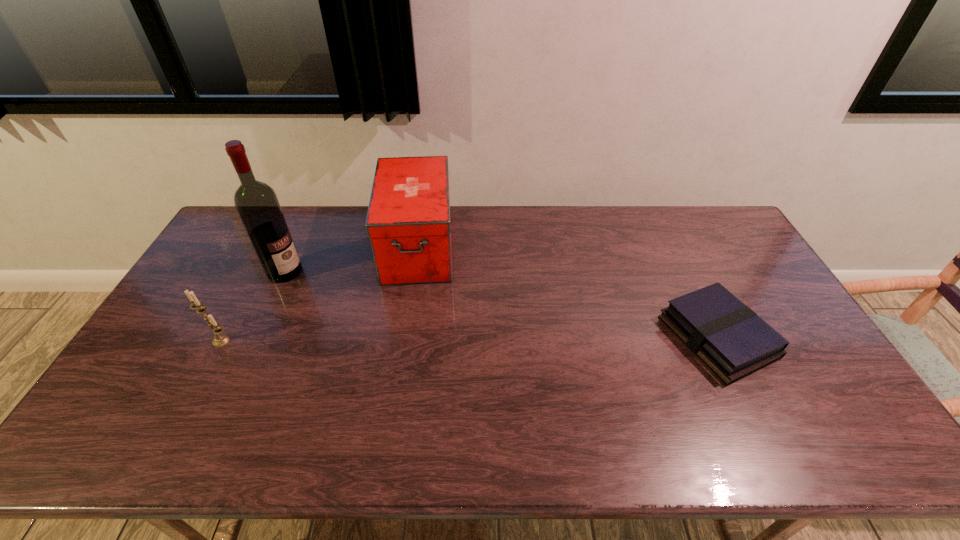
Find the location of a particular element. The image size is (960, 540). vacant space that is in between the candle and the rightmost object is located at coordinates (469, 339).

Image resolution: width=960 pixels, height=540 pixels. In order to click on vacant area between the book and the candle in this screenshot , I will do `click(469, 339)`.

This screenshot has width=960, height=540. In order to click on empty location between the tallest object and the book in this screenshot , I will do `click(501, 304)`.

Point out which object is positioned as the nearest to the candle. Please provide its 2D coordinates. Your answer should be formatted as a tuple, i.e. [(x, y)], where the tuple contains the x and y coordinates of a point satisfying the conditions above.

[(257, 204)]

Find the location of a particular element. object that is the second closest one to the alcohol is located at coordinates point(408,223).

This screenshot has height=540, width=960. I want to click on free point that satisfies the following two spatial constraints: 1. on the back side of the tallest object; 2. on the left side of the second shortest object, so click(x=257, y=272).

Identify the location of vacant area that satisfies the following two spatial constraints: 1. on the back side of the first-aid kit; 2. on the left side of the second shortest object. (271, 247).

Where is `free location that satisfies the following two spatial constraints: 1. on the front side of the book; 2. on the right side of the alcohol`? free location that satisfies the following two spatial constraints: 1. on the front side of the book; 2. on the right side of the alcohol is located at coordinates (255, 336).

Where is `blank area in the image that satisfies the following two spatial constraints: 1. on the back side of the third object from left to right; 2. on the left side of the candle`? blank area in the image that satisfies the following two spatial constraints: 1. on the back side of the third object from left to right; 2. on the left side of the candle is located at coordinates (271, 247).